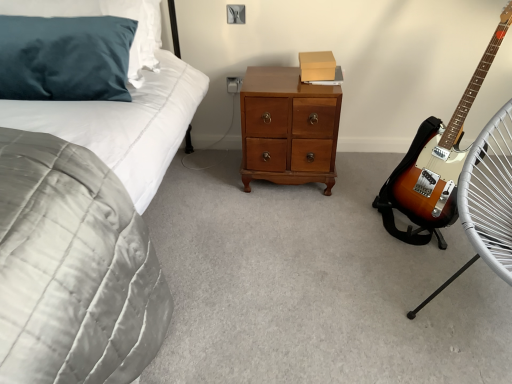
You are a GUI agent. You are given a task and a screenshot of the screen. Output one action in this format:
    pyautogui.click(x=<x>, y=<y>)
    Task: Click on the free space that is to the left of shiny brown wooden chest of drawers at center
    
    Given the screenshot: What is the action you would take?
    pyautogui.click(x=207, y=173)